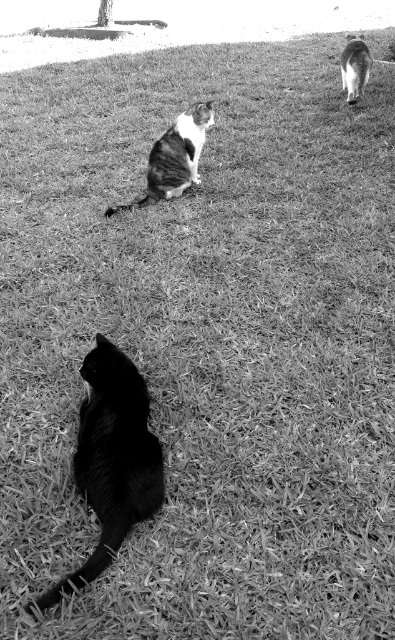
You are standing in the grassy area and want to throw a ball towards the striped fur cat at center. Considering the coordinates provided, in which general direction should you aim relative to your position?

The striped fur cat at center is located at coordinates point (174, 157), which means you should aim slightly to the left and lower middle direction from your current position.

You are standing in the grassy area and want to find the black fur cat at lower left. According to the coordinates provided, where should you look relative to the image frame?

The black fur cat at lower left is located at coordinates point 0.717 on the x axis and 0.284 on the y axis, which means it is positioned near the lower left corner of the image frame.